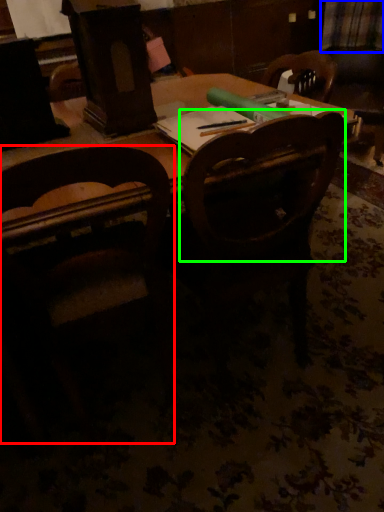
Question: Which object is the farthest from chair (highlighted by a red box)? Choose among these: plaid (highlighted by a blue box) or chair (highlighted by a green box).

Choices:
 (A) plaid
 (B) chair

Answer: (A)